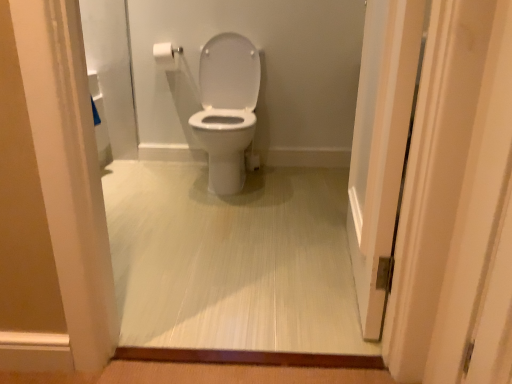
Image resolution: width=512 pixels, height=384 pixels. In order to click on vacant area that lies between white glossy door at right and white glossy toilet at center in this screenshot , I will do `click(279, 226)`.